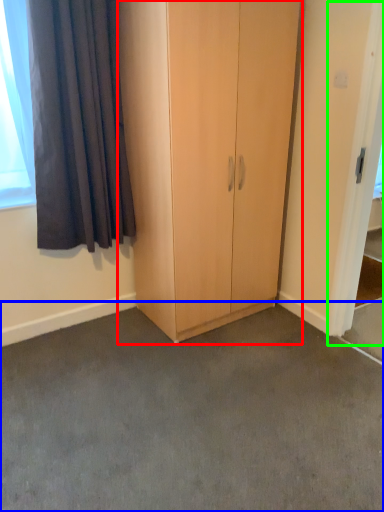
Question: Which object is the farthest from cupboard (highlighted by a red box)? Choose among these: concrete (highlighted by a blue box) or screen door (highlighted by a green box).

Choices:
 (A) concrete
 (B) screen door

Answer: (A)